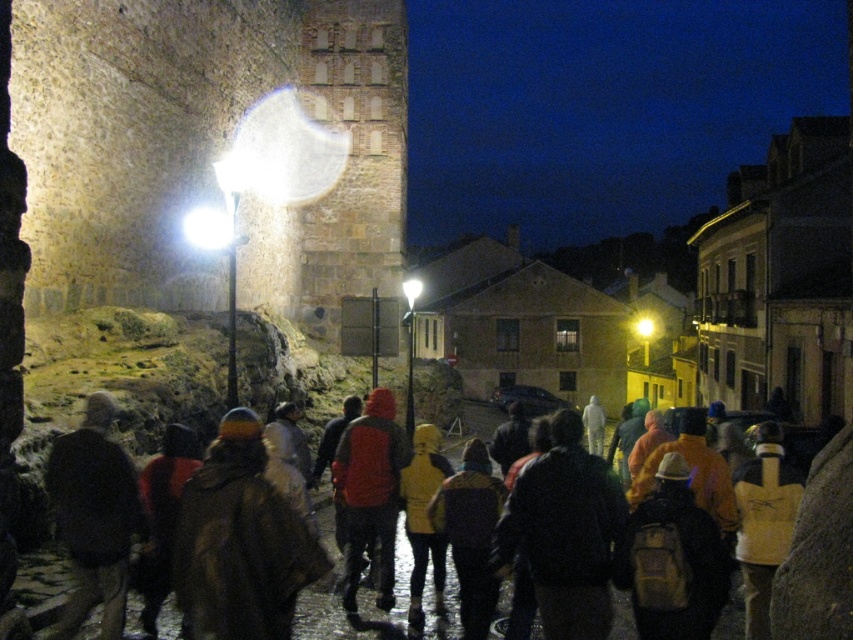
Between brown textured jacket at center and red matte jacket at center, which one has more height?

red matte jacket at center is taller.

Is point (425, 637) closer to viewer compared to point (352, 586)?

That is True.

The height and width of the screenshot is (640, 853). I want to click on brown textured jacket at center, so click(358, 609).

Does brick textured tower at center have a greater height compared to red matte jacket at center?

Yes, brick textured tower at center is taller than red matte jacket at center.

Which of these two, brick textured tower at center or red matte jacket at center, stands shorter?

Standing shorter between the two is red matte jacket at center.

Where is `brick textured tower at center`? brick textured tower at center is located at coordinates (354, 156).

The width and height of the screenshot is (853, 640). Identify the location of brick textured tower at center. (354, 156).

Is black fabric jacket at lower left taller than red matte jacket at center?

No, black fabric jacket at lower left is not taller than red matte jacket at center.

Who is more distant from viewer, (x=114, y=531) or (x=350, y=493)?

Positioned behind is point (x=350, y=493).

Identify the location of black fabric jacket at lower left. (94, 516).